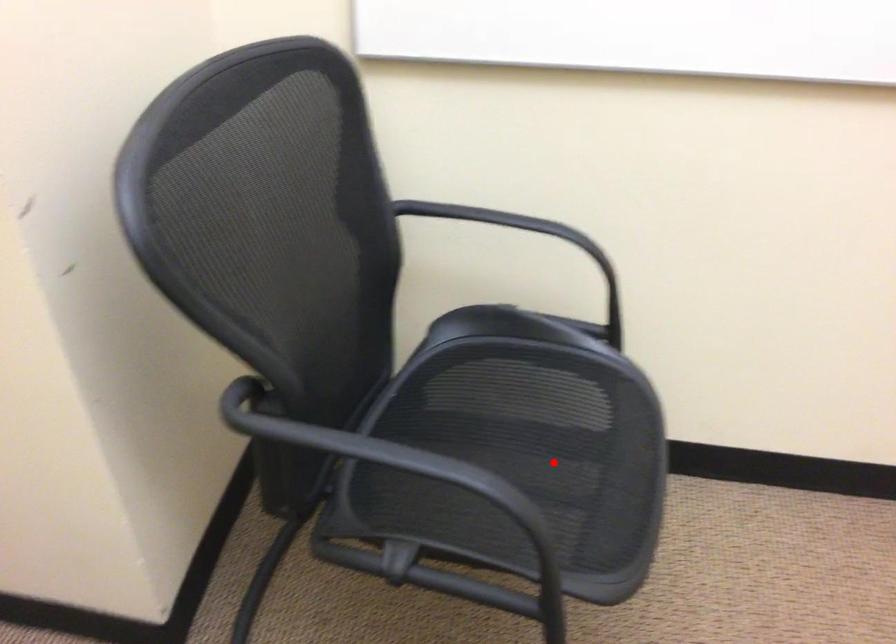
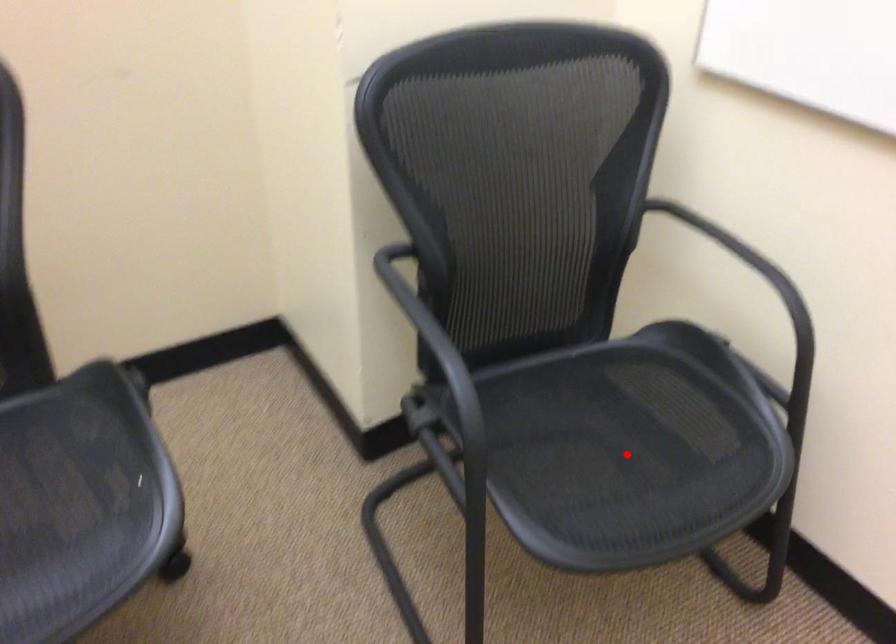
I am providing you with two images of the same scene from different viewpoints. A red point is marked on the first image and another point is marked on the second image. Is the marked point in image1 the same physical position as the marked point in image2?

Yes